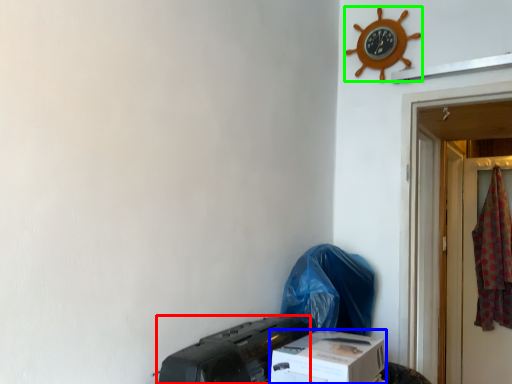
Question: Based on their relative distances, which object is nearer to printer (highlighted by a red box)? Choose from box (highlighted by a blue box) and clock (highlighted by a green box).

Choices:
 (A) box
 (B) clock

Answer: (A)